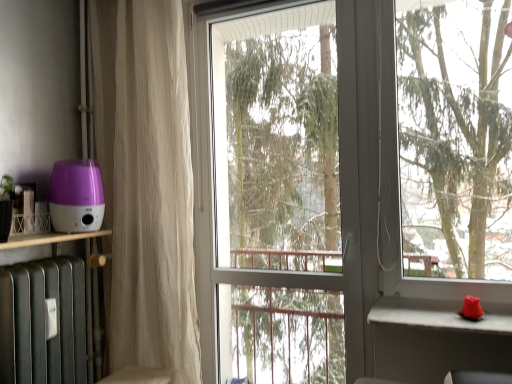
Question: Does white sheer curtain at left have a lesser height compared to transparent glass screen door at center?

Choices:
 (A) yes
 (B) no

Answer: (B)

Question: Considering the relative sizes of white sheer curtain at left and transparent glass screen door at center in the image provided, is white sheer curtain at left wider than transparent glass screen door at center?

Choices:
 (A) no
 (B) yes

Answer: (B)

Question: From a real-world perspective, is white sheer curtain at left positioned over transparent glass screen door at center based on gravity?

Choices:
 (A) no
 (B) yes

Answer: (B)

Question: Would you say white sheer curtain at left contains transparent glass screen door at center?

Choices:
 (A) yes
 (B) no

Answer: (B)

Question: Could you tell me if white sheer curtain at left is facing transparent glass screen door at center?

Choices:
 (A) yes
 (B) no

Answer: (B)

Question: Does white sheer curtain at left lie behind transparent glass screen door at center?

Choices:
 (A) yes
 (B) no

Answer: (A)

Question: Does white sheer curtain at left come in front of white concrete window sill at right?

Choices:
 (A) no
 (B) yes

Answer: (A)

Question: Can you confirm if white sheer curtain at left is thinner than white concrete window sill at right?

Choices:
 (A) no
 (B) yes

Answer: (B)

Question: From the image's perspective, is white sheer curtain at left under white concrete window sill at right?

Choices:
 (A) yes
 (B) no

Answer: (B)

Question: Would you say white sheer curtain at left is outside white concrete window sill at right?

Choices:
 (A) no
 (B) yes

Answer: (B)

Question: From a real-world perspective, is white sheer curtain at left under white concrete window sill at right?

Choices:
 (A) yes
 (B) no

Answer: (B)

Question: Is white sheer curtain at left turned away from white concrete window sill at right?

Choices:
 (A) no
 (B) yes

Answer: (A)

Question: Is purple plastic humidifier at left bigger than white sheer curtain at left?

Choices:
 (A) no
 (B) yes

Answer: (A)